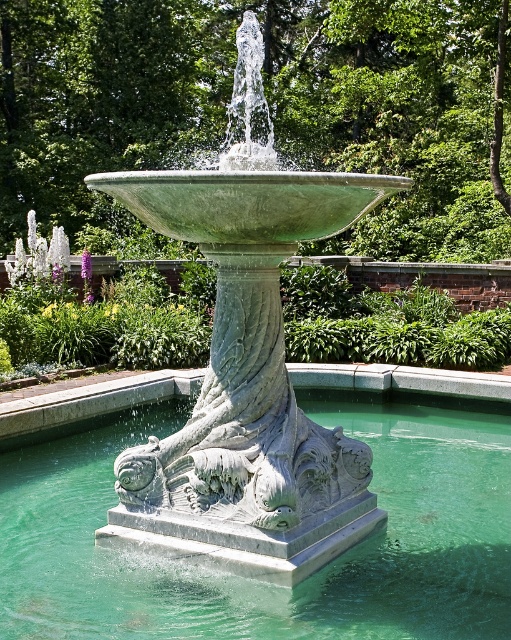
You are a landscape architect planning to add a new statue to the garden. The statue will be placed between the green stone water at center and the green stone fountain at center. Which side of the statue should face the narrower object to ensure proper alignment?

The green stone water at center is wider than the green stone fountain at center. Therefore, the statue should face the green stone fountain at center, which is the narrower object.

You are standing at the edge of the rectangular pool surrounding the fountain. You want to place a decorative statue that is 3 meters wide between the green stone water at center and the green stone fountain at center. Is there enough space for the statue?

The distance between the green stone water at center and the green stone fountain at center is 2.69 meters. Since the statue is 3 meters wide, it is slightly wider than the available space. Therefore, the statue will not fit between them.